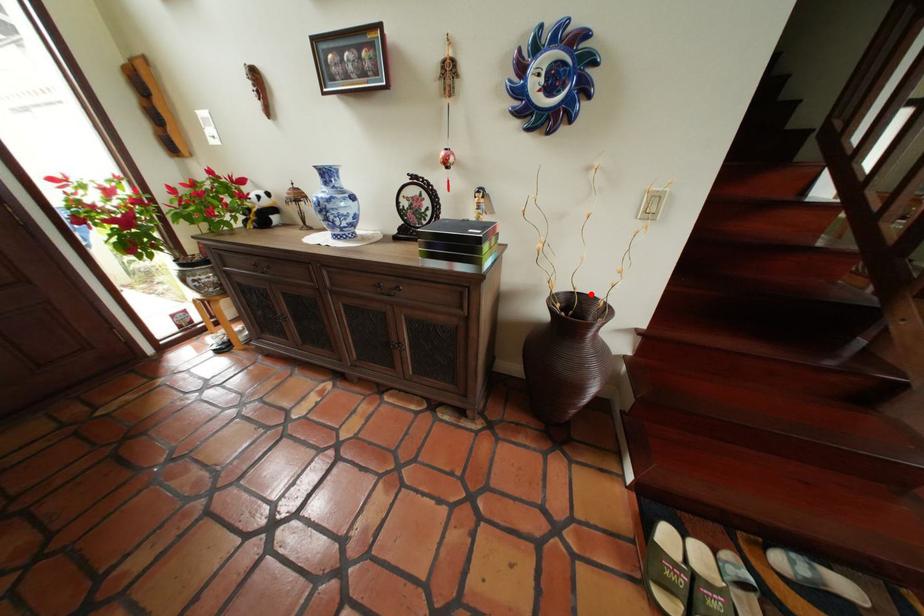
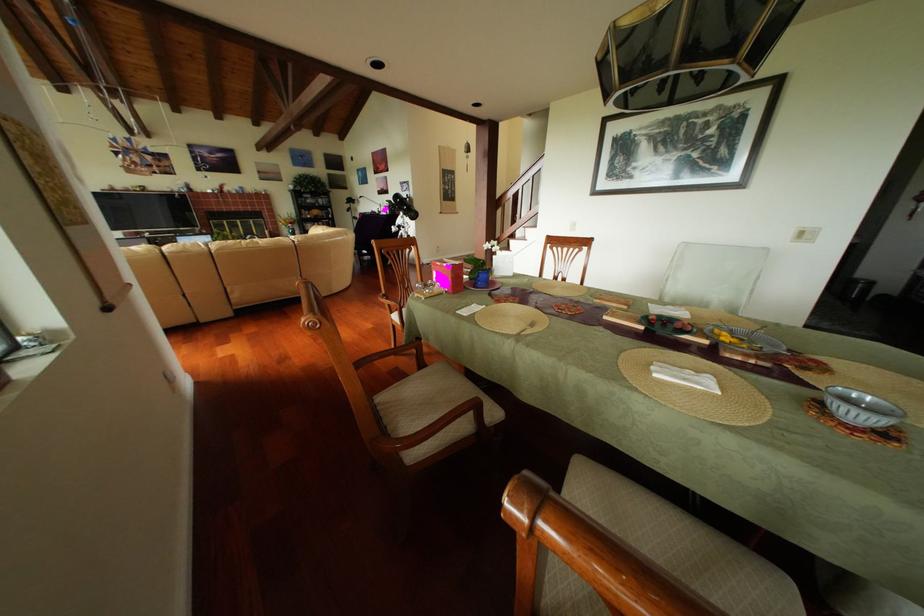
Question: I am providing you with two images of the same scene from different viewpoints. A red point is marked on the first image. At the location where the point appears in image 1, is it still visible in image 2?

Choices:
 (A) Yes
 (B) No

Answer: (B)